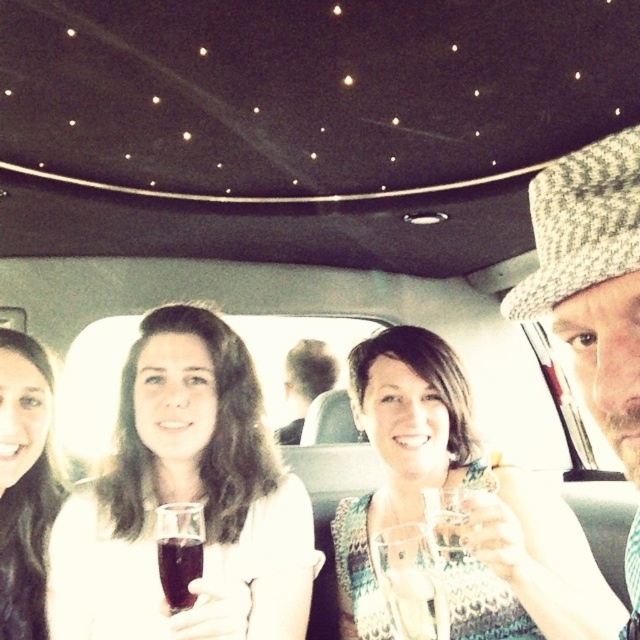
You are a passenger in the limousine and want to grab your drink without reaching over others. Given the scene, can you safely reach the clear glass wine glass at center from the position of the matte white shirt at center?

The matte white shirt at center is to the left of the clear glass wine glass at center, so you can safely reach the clear glass wine glass at center without reaching over others by extending your right hand.

In the limousine scene, there are two people visible with distinct headwear. The knitted wool hat at right and the smooth brown hair at left. Which of these two items is positioned more to the east in the image?

The knitted wool hat at right is to the right of smooth brown hair at left, so it is positioned more to the east in the image.

You are a photographer inside the limousine and want to take a photo of the knitted wool hat at right and the smooth brown hair at left. Which object is shorter in height?

The knitted wool hat at right is not as tall as the smooth brown hair at left, so the knitted wool hat at right is shorter in height.